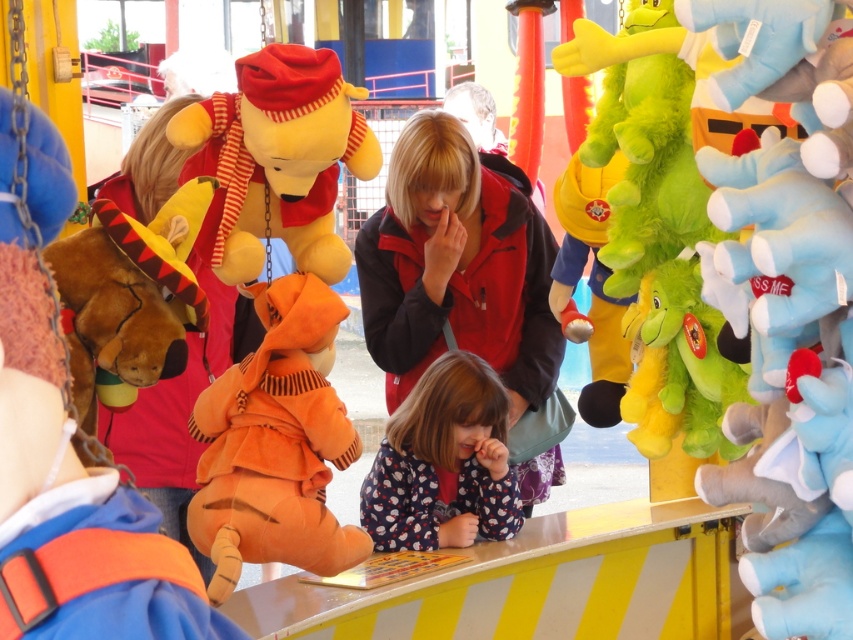
You are at a fairground and want to buy a fluffy red jacket at center. Where exactly is the jacket positioned relative to the plush toys displayed on the counter?

The fluffy red jacket at center is located at point coordinates 0.416 along the horizontal axis and 0.537 along the vertical axis relative to the plush toys displayed on the counter.